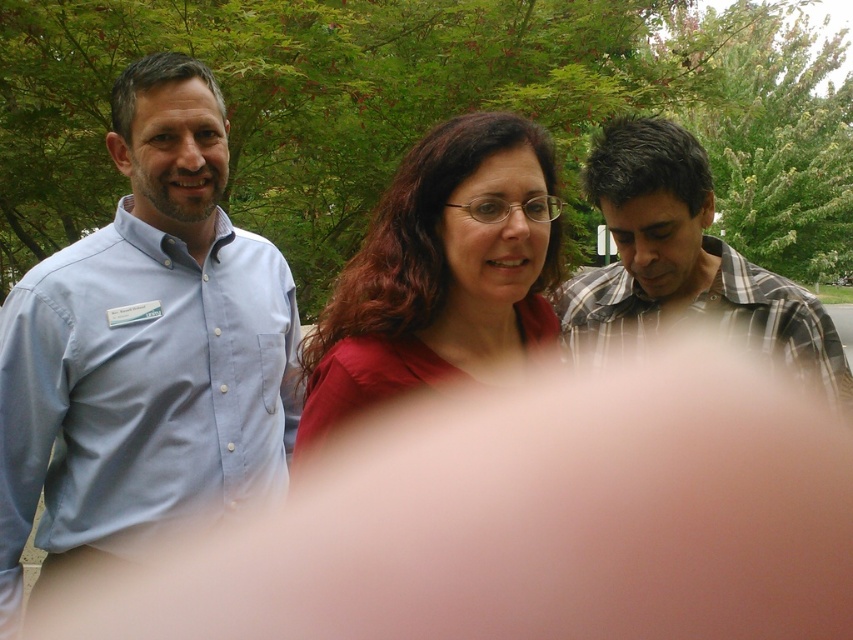
Question: Among these objects, which one is nearest to the camera?

Choices:
 (A) matte red shirt at center
 (B) plaid cotton shirt at right
 (C) light blue button-down shirt at left

Answer: (A)

Question: Observing the image, what is the correct spatial positioning of light blue button-down shirt at left in reference to plaid cotton shirt at right?

Choices:
 (A) left
 (B) right

Answer: (A)

Question: Does matte red shirt at center appear on the left side of plaid cotton shirt at right?

Choices:
 (A) yes
 (B) no

Answer: (A)

Question: Which point is farther to the camera?

Choices:
 (A) (485, 253)
 (B) (109, 260)

Answer: (B)

Question: Does light blue button-down shirt at left lie in front of matte red shirt at center?

Choices:
 (A) no
 (B) yes

Answer: (A)

Question: Which of the following is the farthest from the observer?

Choices:
 (A) coord(212,221)
 (B) coord(345,413)

Answer: (A)